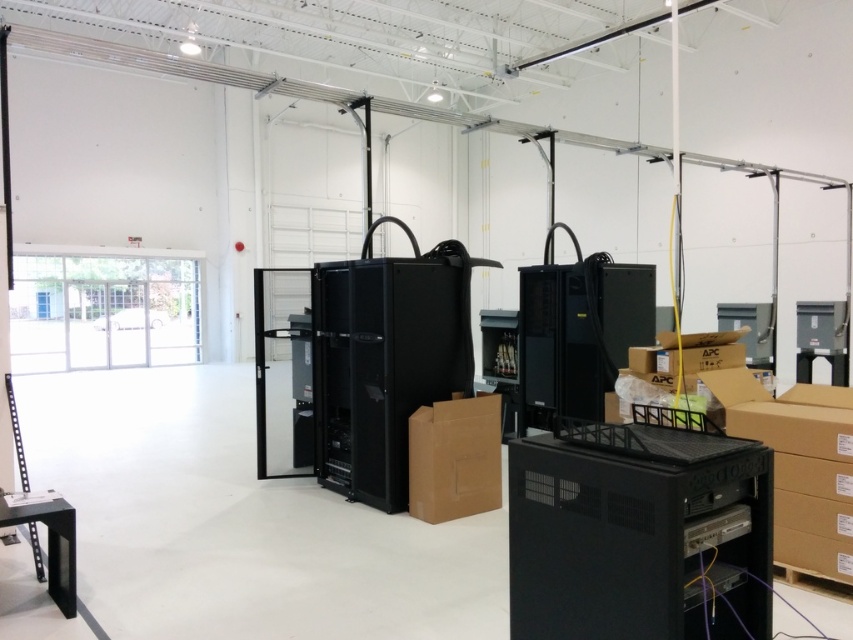
Does black matte server at center have a larger size compared to brown cardboard box at center?

Yes, black matte server at center is bigger than brown cardboard box at center.

From the picture: Who is taller, black matte server at center or brown cardboard box at center?

Standing taller between the two is black matte server at center.

Describe the element at coordinates (578, 333) in the screenshot. I see `black matte server at center` at that location.

What are the coordinates of `black matte server at center` in the screenshot? It's located at (578, 333).

Measure the distance between black plastic server at center and camera.

They are 6.04 feet apart.

Image resolution: width=853 pixels, height=640 pixels. In order to click on black plastic server at center in this screenshot , I will do `click(637, 534)`.

Is point (654, 586) positioned after point (462, 428)?

No, (654, 586) is in front of (462, 428).

At what (x,y) coordinates should I click in order to perform the action: click on black plastic server at center. Please return your answer as a coordinate pair (x, y). Looking at the image, I should click on (637, 534).

Is point (724, 445) positioned in front of point (582, 348)?

Yes, it is.

Does black plastic server at center have a larger size compared to black matte server at center?

No.

Does point (561, 481) lie behind point (521, 291)?

No.

Locate an element on the screen. The width and height of the screenshot is (853, 640). black plastic server at center is located at coordinates (637, 534).